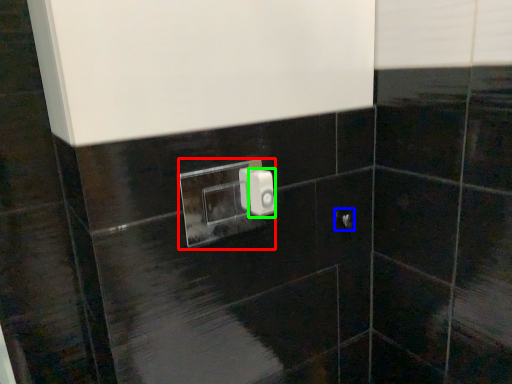
Question: Which object is the farthest from light switch (highlighted by a red box)? Choose among these: door handle (highlighted by a blue box) or light switch (highlighted by a green box).

Choices:
 (A) door handle
 (B) light switch

Answer: (B)